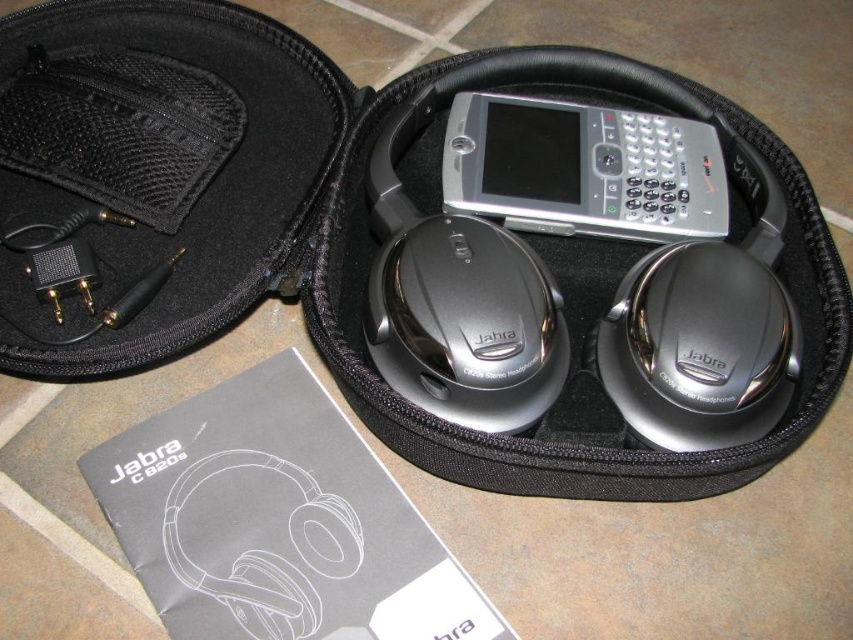
Does silver metallic smartphone at center appear under satin silver headphones at center?

No.

Does silver metallic smartphone at center have a greater height compared to satin silver headphones at center?

No, silver metallic smartphone at center is not taller than satin silver headphones at center.

Where is `silver metallic smartphone at center`? silver metallic smartphone at center is located at coordinates point(583,170).

At what (x,y) coordinates should I click in order to perform the action: click on silver metallic smartphone at center. Please return your answer as a coordinate pair (x, y). Image resolution: width=853 pixels, height=640 pixels. Looking at the image, I should click on (583, 170).